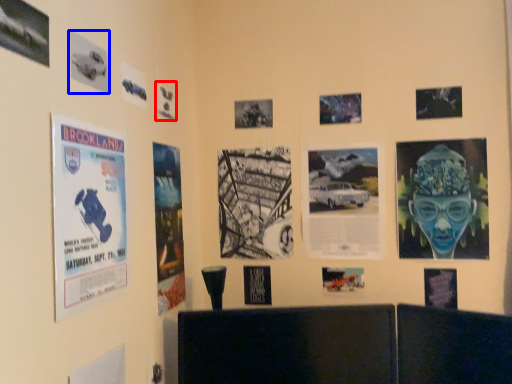
Question: Which of the following is the closest to the observer, poster (highlighted by a red box) or poster (highlighted by a blue box)?

Choices:
 (A) poster
 (B) poster

Answer: (B)